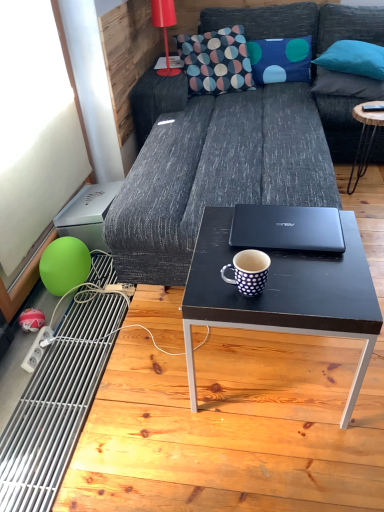
Locate an element on the screen. The width and height of the screenshot is (384, 512). free point to the right of white dotted ceramic mug at center is located at coordinates (306, 284).